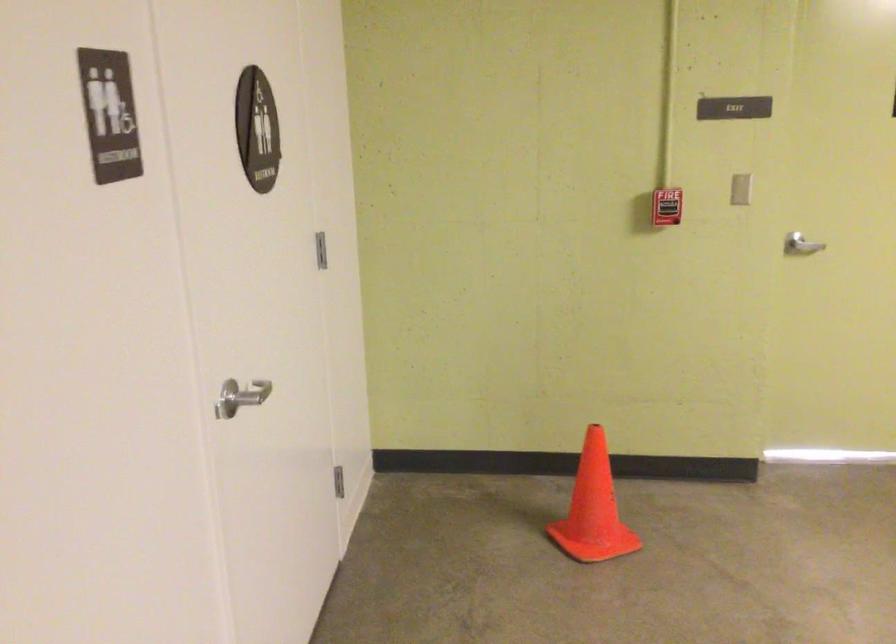
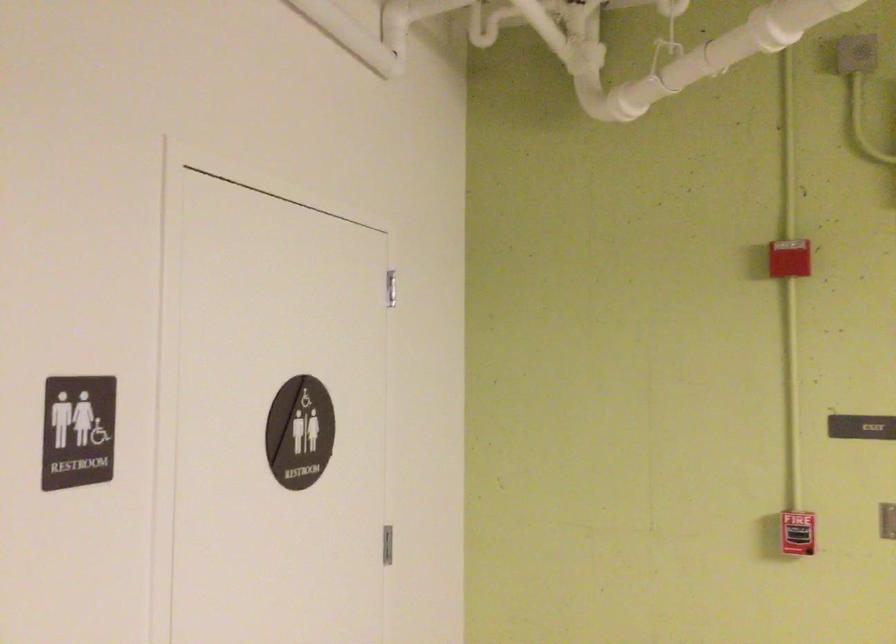
Question: In a continuous first-person perspective shot, in which direction is the camera moving?

Choices:
 (A) Left
 (B) Right
 (C) Forward
 (D) Backward

Answer: (B)